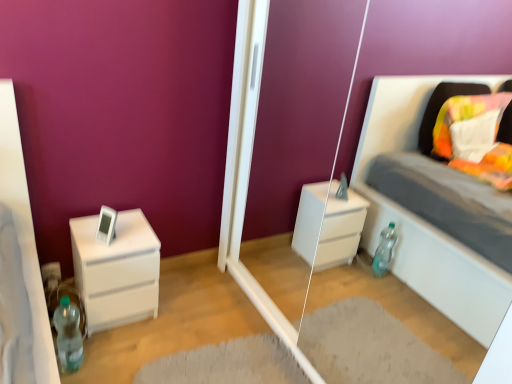
Describe the element at coordinates (116, 270) in the screenshot. I see `white matte chest of drawers at left` at that location.

Identify the location of white matte chest of drawers at left. (116, 270).

Is transparent glass door at center inside white matte chest of drawers at left?

No.

Considering the sizes of objects white matte chest of drawers at left and transparent glass door at center in the image provided, who is taller, white matte chest of drawers at left or transparent glass door at center?

transparent glass door at center.

From the image's perspective, is white matte chest of drawers at left positioned above or below transparent glass door at center?

white matte chest of drawers at left is below transparent glass door at center.

Considering the sizes of translucent plastic bottle at lower left and white matte chest of drawers at left in the image, is translucent plastic bottle at lower left taller or shorter than white matte chest of drawers at left?

Clearly, translucent plastic bottle at lower left is shorter compared to white matte chest of drawers at left.

From the image's perspective, who appears lower, translucent plastic bottle at lower left or white matte chest of drawers at left?

translucent plastic bottle at lower left, from the image's perspective.

Is translucent plastic bottle at lower left positioned before white matte chest of drawers at left?

Yes, translucent plastic bottle at lower left is in front of white matte chest of drawers at left.

From a real-world perspective, relative to white matte chest of drawers at left, is translucent plastic bottle at lower left vertically above or below?

Clearly, from a real-world perspective, translucent plastic bottle at lower left is below white matte chest of drawers at left.

From a real-world perspective, who is located higher, white matte chest of drawers at left or translucent plastic bottle at lower left?

In real-world perspective, white matte chest of drawers at left is above.

Does point (143, 264) come in front of point (64, 323)?

Yes, point (143, 264) is in front of point (64, 323).

Between white matte chest of drawers at left and translucent plastic bottle at lower left, which one is positioned behind?

white matte chest of drawers at left is more distant.

Considering the sizes of objects transparent glass door at center and white matte chest of drawers at left in the image provided, who is taller, transparent glass door at center or white matte chest of drawers at left?

Standing taller between the two is transparent glass door at center.

Is point (253, 129) positioned after point (99, 242)?

Yes, point (253, 129) is farther from viewer.

Consider the image. Considering the sizes of transparent glass door at center and white matte chest of drawers at left in the image, is transparent glass door at center bigger or smaller than white matte chest of drawers at left?

Clearly, transparent glass door at center is larger in size than white matte chest of drawers at left.

Considering the relative sizes of transparent glass door at center and white matte chest of drawers at left in the image provided, is transparent glass door at center thinner than white matte chest of drawers at left?

Yes.

Is translucent plastic bottle at lower left facing towards transparent glass door at center?

No, translucent plastic bottle at lower left does not turn towards transparent glass door at center.

Can you confirm if translucent plastic bottle at lower left is positioned to the left of transparent glass door at center?

Indeed, translucent plastic bottle at lower left is positioned on the left side of transparent glass door at center.

Considering the relative sizes of translucent plastic bottle at lower left and transparent glass door at center in the image provided, is translucent plastic bottle at lower left taller than transparent glass door at center?

No, translucent plastic bottle at lower left is not taller than transparent glass door at center.

From a real-world perspective, which object stands above the other?

From a 3D spatial view, transparent glass door at center is above.

Between transparent glass door at center and translucent plastic bottle at lower left, which one appears on the right side from the viewer's perspective?

From the viewer's perspective, transparent glass door at center appears more on the right side.

Is transparent glass door at center far from translucent plastic bottle at lower left?

No.

Who is more distant, transparent glass door at center or translucent plastic bottle at lower left?

translucent plastic bottle at lower left.

In the scene shown: Which of these two, transparent glass door at center or translucent plastic bottle at lower left, is thinner?

With smaller width is translucent plastic bottle at lower left.

The height and width of the screenshot is (384, 512). There is a white matte chest of drawers at left. In order to click on glass door above it (from a real-world perspective) in this screenshot , I will do `click(249, 170)`.

You are a GUI agent. You are given a task and a screenshot of the screen. Output one action in this format:
    pyautogui.click(x=<x>, y=<y>)
    Task: Click on the chest of drawers behind the translucent plastic bottle at lower left
    The image size is (512, 384).
    Given the screenshot: What is the action you would take?
    pyautogui.click(x=116, y=270)

Estimate the real-world distances between objects in this image. Which object is further from translucent plastic bottle at lower left, white matte chest of drawers at left or transparent glass door at center?

transparent glass door at center lies further to translucent plastic bottle at lower left than the other object.

From the image, which object appears to be farther from transparent glass door at center, white matte chest of drawers at left or translucent plastic bottle at lower left?

The object further to transparent glass door at center is translucent plastic bottle at lower left.

From the image, which object appears to be farther from translucent plastic bottle at lower left, transparent glass door at center or white matte chest of drawers at left?

A: transparent glass door at center is further to translucent plastic bottle at lower left.

Based on their spatial positions, is translucent plastic bottle at lower left or white matte chest of drawers at left closer to transparent glass door at center?

white matte chest of drawers at left is closer to transparent glass door at center.

Which object lies further to the anchor point white matte chest of drawers at left, transparent glass door at center or translucent plastic bottle at lower left?

Among the two, transparent glass door at center is located further to white matte chest of drawers at left.

Based on their spatial positions, is translucent plastic bottle at lower left or transparent glass door at center further from white matte chest of drawers at left?

Among the two, transparent glass door at center is located further to white matte chest of drawers at left.

You are a GUI agent. You are given a task and a screenshot of the screen. Output one action in this format:
    pyautogui.click(x=<x>, y=<y>)
    Task: Click on the chest of drawers between translucent plastic bottle at lower left and transparent glass door at center
    Image resolution: width=512 pixels, height=384 pixels.
    Given the screenshot: What is the action you would take?
    pyautogui.click(x=116, y=270)